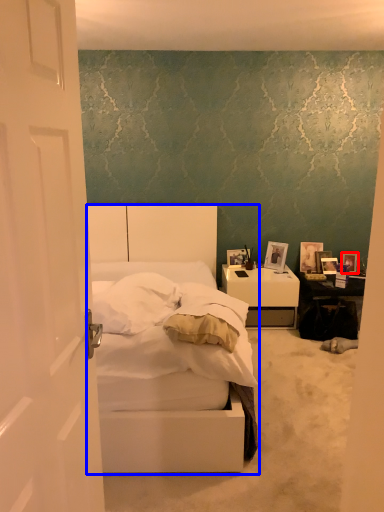
Question: Which point is further to the camera, picture frame (highlighted by a red box) or bed (highlighted by a blue box)?

Choices:
 (A) picture frame
 (B) bed

Answer: (A)